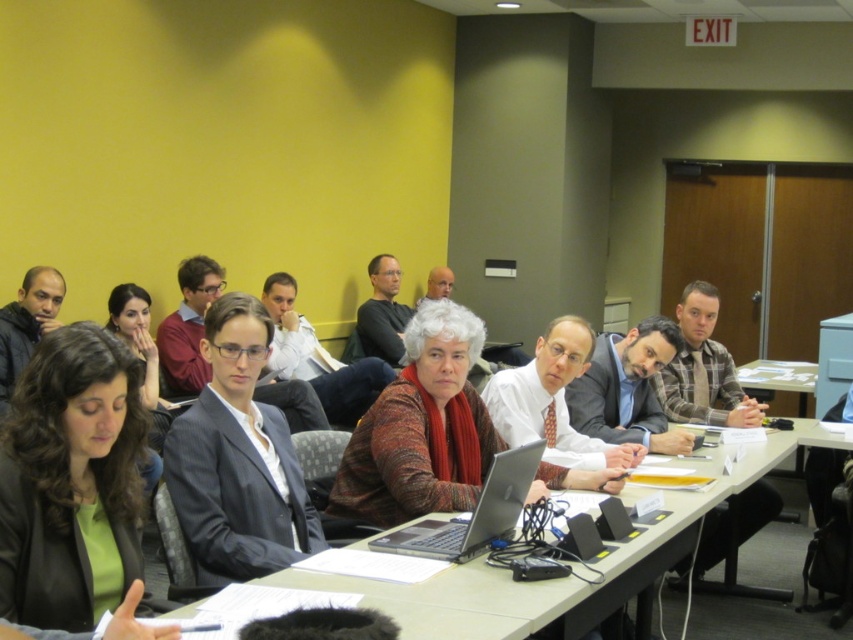
Question: Considering the relative positions of light brown wooden table at center and gray suit at center in the image provided, where is light brown wooden table at center located with respect to gray suit at center?

Choices:
 (A) below
 (B) above

Answer: (A)

Question: Considering the real-world distances, which object is closest to the matte gray suit at center?

Choices:
 (A) silver metallic laptop at center
 (B) green matte blazer at lower left
 (C) light brown wooden table at center

Answer: (C)

Question: Can you confirm if green matte blazer at lower left is positioned below matte gray suit at center?

Choices:
 (A) no
 (B) yes

Answer: (B)

Question: Can you confirm if green matte blazer at lower left is wider than silver metallic laptop at center?

Choices:
 (A) yes
 (B) no

Answer: (B)

Question: Which point appears farthest from the camera in this image?

Choices:
 (A) (207, 342)
 (B) (720, 632)

Answer: (B)

Question: Based on their relative distances, which object is farther from the green matte blazer at lower left?

Choices:
 (A) matte gray suit at center
 (B) white paper at center
 (C) light brown wooden table at center
 (D) gray suit at center

Answer: (B)